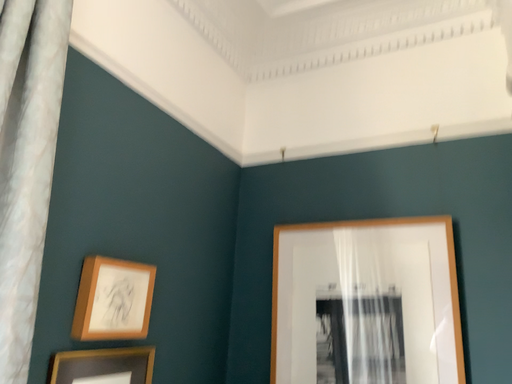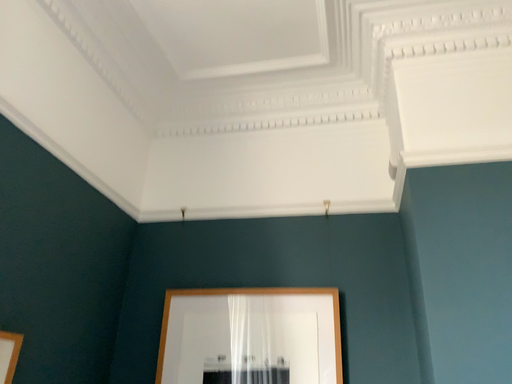
Question: How did the camera likely rotate when shooting the video?

Choices:
 (A) rotated right
 (B) rotated left

Answer: (A)